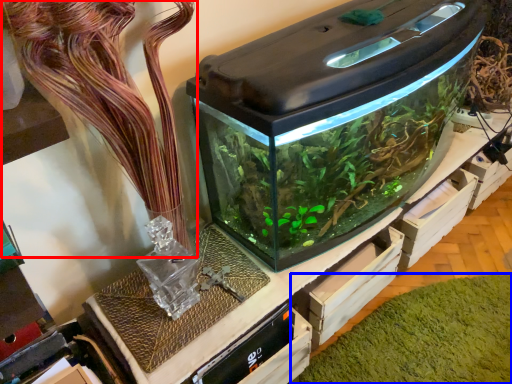
Question: Which object appears farthest to the camera in this image, plant (highlighted by a red box) or algae (highlighted by a blue box)?

Choices:
 (A) plant
 (B) algae

Answer: (B)